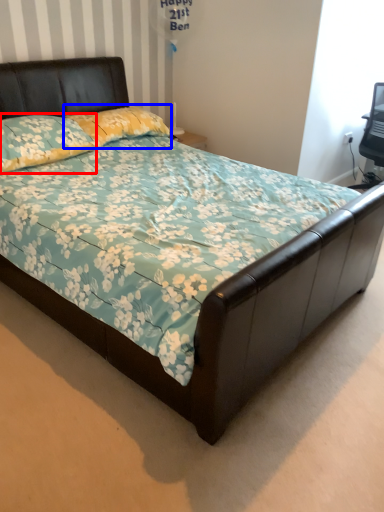
Question: Which of the following is the closest to the observer, pillow (highlighted by a red box) or pillow (highlighted by a blue box)?

Choices:
 (A) pillow
 (B) pillow

Answer: (A)